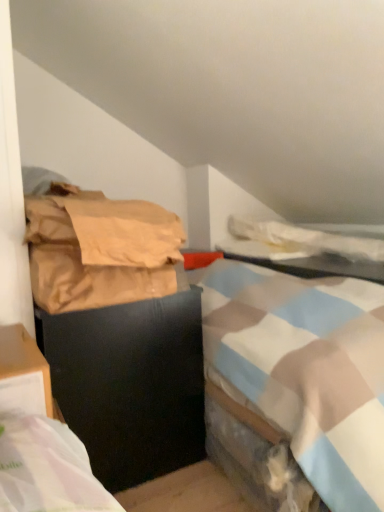
Question: Does brown paper bag at left touch matte plastic table at center?

Choices:
 (A) yes
 (B) no

Answer: (B)

Question: Is brown paper bag at left far away from matte plastic table at center?

Choices:
 (A) yes
 (B) no

Answer: (B)

Question: Does brown paper bag at left have a smaller size compared to matte plastic table at center?

Choices:
 (A) yes
 (B) no

Answer: (A)

Question: Is matte plastic table at center at the back of brown paper bag at left?

Choices:
 (A) no
 (B) yes

Answer: (A)

Question: Can you confirm if brown paper bag at left is shorter than matte plastic table at center?

Choices:
 (A) yes
 (B) no

Answer: (B)

Question: Does brown paper bag at left have a larger size compared to matte plastic table at center?

Choices:
 (A) no
 (B) yes

Answer: (A)

Question: From a real-world perspective, is matte plastic table at center positioned over brown paper bag at left based on gravity?

Choices:
 (A) yes
 (B) no

Answer: (B)

Question: Is matte plastic table at center behind brown paper bag at left?

Choices:
 (A) no
 (B) yes

Answer: (B)

Question: From the image's perspective, is matte plastic table at center on brown paper bag at left?

Choices:
 (A) yes
 (B) no

Answer: (B)

Question: Can you confirm if matte plastic table at center is thinner than brown paper bag at left?

Choices:
 (A) yes
 (B) no

Answer: (B)

Question: Does matte plastic table at center have a lesser height compared to brown paper bag at left?

Choices:
 (A) no
 (B) yes

Answer: (B)

Question: Is matte plastic table at center turned away from brown paper bag at left?

Choices:
 (A) yes
 (B) no

Answer: (B)

Question: Does black matte trash can at left lie behind matte plastic table at center?

Choices:
 (A) yes
 (B) no

Answer: (B)